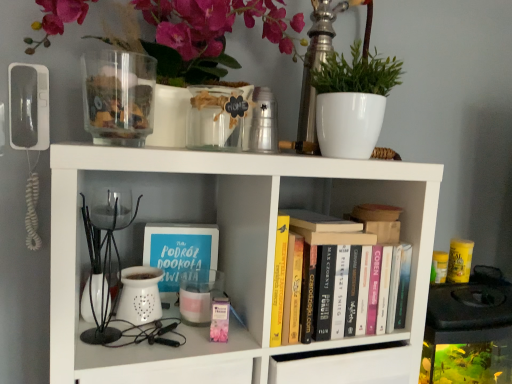
Question: From their relative heights in the image, would you say matte white vase at upper center is taller or shorter than white matte bookshelf at center?

Choices:
 (A) short
 (B) tall

Answer: (A)

Question: Relative to white matte bookshelf at center, is matte white vase at upper center in front or behind?

Choices:
 (A) behind
 (B) front

Answer: (A)

Question: Estimate the real-world distances between objects in this image. Which object is closer to the matte white vase at upper center?

Choices:
 (A) hardcover books at center
 (B) transparent glass jar at upper center, which is counted as the second glass vase, starting from the left
 (C) white ceramic plant at upper right
 (D) transparent glass jar at upper left, the second glass vase viewed from the right
 (E) blue matte book at center-left

Answer: (D)

Question: Which object is positioned closest to the matte white vase at upper center?

Choices:
 (A) transparent glass jar at upper left, positioned as the first glass vase in left-to-right order
 (B) transparent glass jar at upper center, which is counted as the second glass vase, starting from the left
 (C) blue matte book at center-left
 (D) hardcover books at center
 (E) white ceramic plant at upper right

Answer: (A)